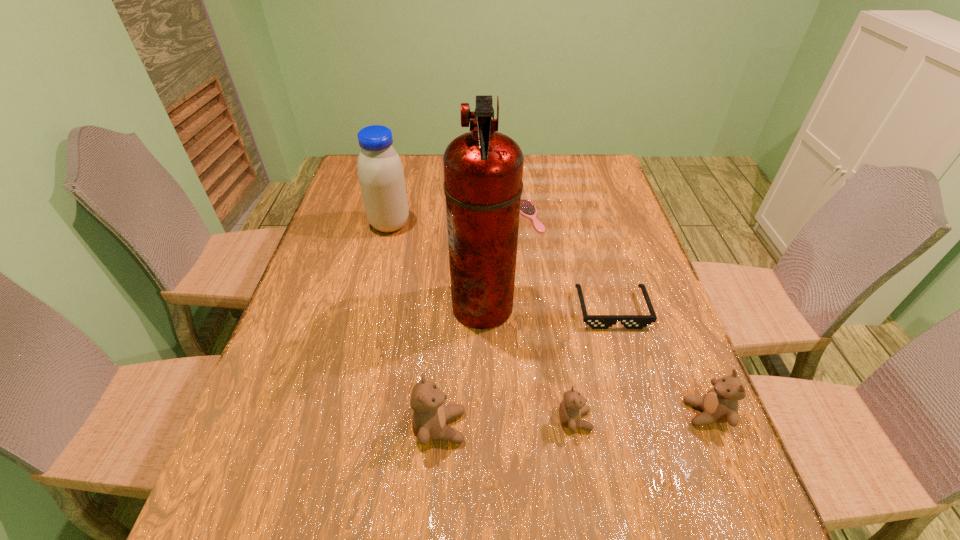
I want to click on free space located on the nozzle side of the fire extinguisher, so click(319, 306).

Where is `vacant space located 0.250m on the nozzle side of the fire extinguisher`? The height and width of the screenshot is (540, 960). vacant space located 0.250m on the nozzle side of the fire extinguisher is located at coordinates (351, 306).

You are a GUI agent. You are given a task and a screenshot of the screen. Output one action in this format:
    pyautogui.click(x=<x>, y=<y>)
    Task: Click on the vacant area situated on the front-facing side of the sunglasses
    The width and height of the screenshot is (960, 540).
    Given the screenshot: What is the action you would take?
    pyautogui.click(x=626, y=361)

Where is `object that is at the left edge`? This screenshot has height=540, width=960. object that is at the left edge is located at coordinates (381, 176).

You are a GUI agent. You are given a task and a screenshot of the screen. Output one action in this format:
    pyautogui.click(x=<x>, y=<y>)
    Task: Click on the teddy bear situated at the right edge
    The height and width of the screenshot is (540, 960).
    Given the screenshot: What is the action you would take?
    click(x=720, y=404)

Identify the location of sunglasses that is at the right edge. Image resolution: width=960 pixels, height=540 pixels. (595, 321).

Image resolution: width=960 pixels, height=540 pixels. In order to click on object positioned at the near right corner in this screenshot , I will do `click(720, 404)`.

You are a GUI agent. You are given a task and a screenshot of the screen. Output one action in this format:
    pyautogui.click(x=<x>, y=<y>)
    Task: Click on the vacant region at the far edge of the desktop
    The width and height of the screenshot is (960, 540).
    Given the screenshot: What is the action you would take?
    pyautogui.click(x=527, y=161)

The width and height of the screenshot is (960, 540). In order to click on free space at the near edge of the desktop in this screenshot , I will do `click(533, 433)`.

You are a GUI agent. You are given a task and a screenshot of the screen. Output one action in this format:
    pyautogui.click(x=<x>, y=<y>)
    Task: Click on the free space at the left edge of the desktop
    The image size is (960, 540).
    Given the screenshot: What is the action you would take?
    pyautogui.click(x=328, y=246)